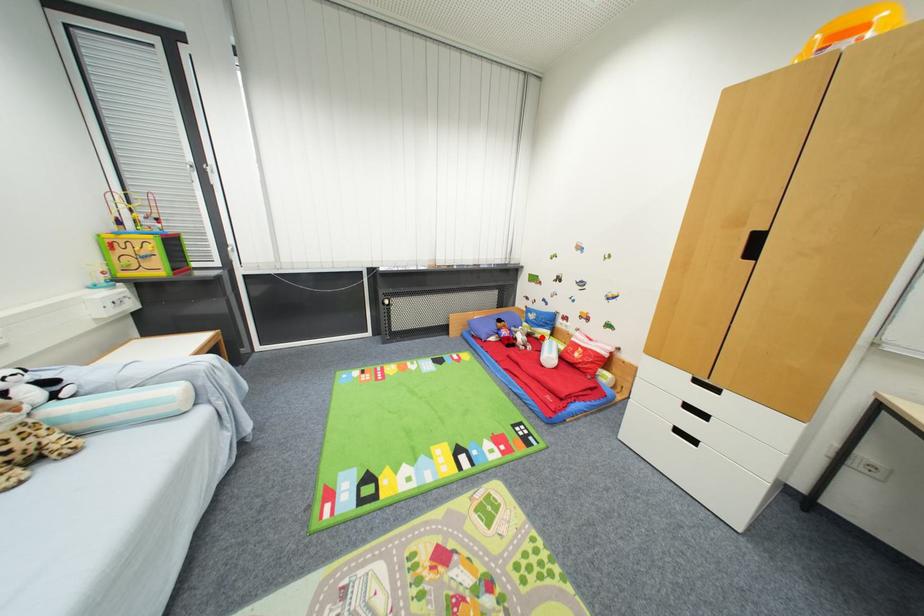
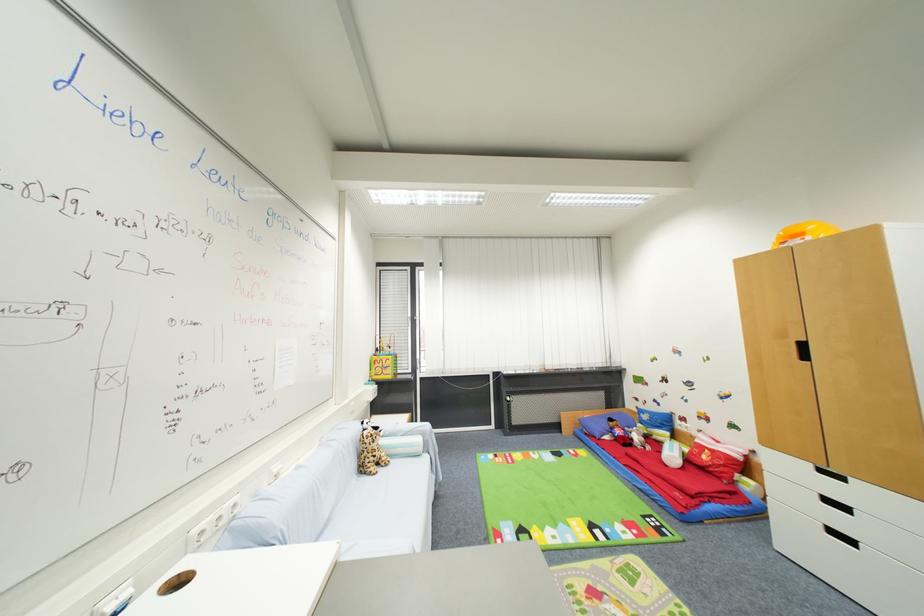
Where in the second image is the point corresponding to the highlighted location from the first image?

(660, 439)